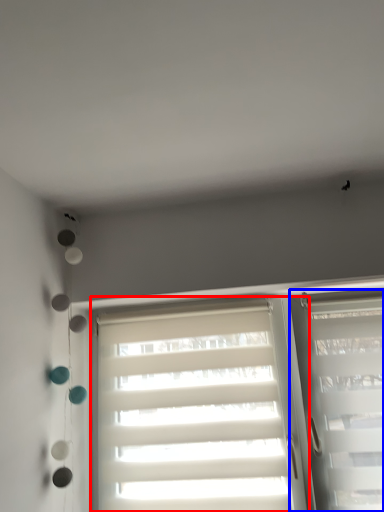
Question: Which of the following is the closest to the observer, window (highlighted by a red box) or window (highlighted by a blue box)?

Choices:
 (A) window
 (B) window

Answer: (B)